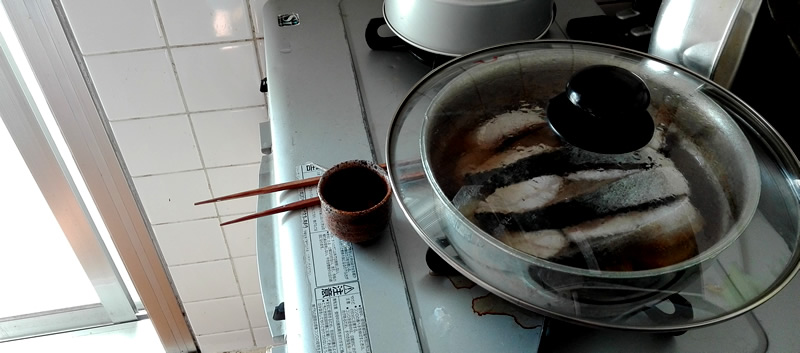
The image size is (800, 353). Find the location of `oven handle`. oven handle is located at coordinates (266, 292).